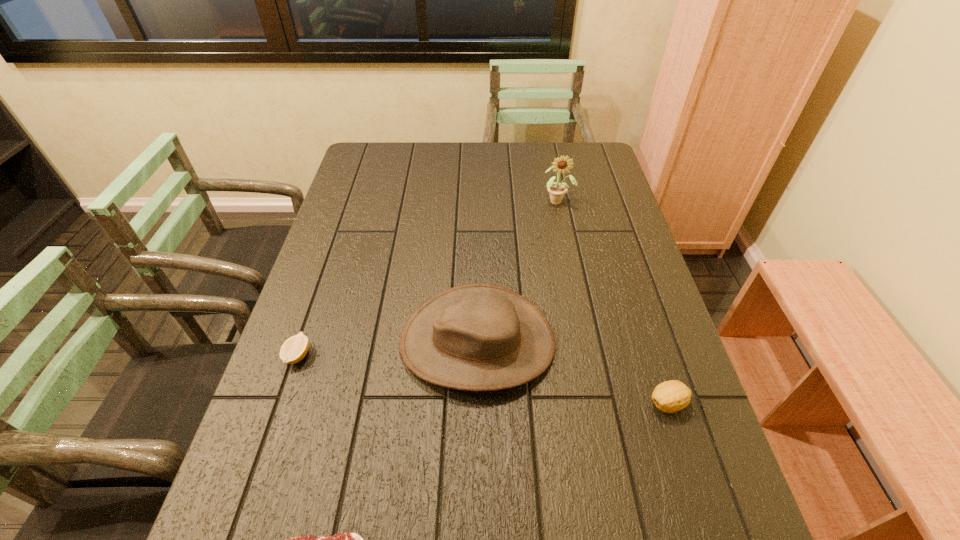
This screenshot has height=540, width=960. I want to click on vacant area between the farthest object and the fourth tallest object, so click(x=428, y=278).

This screenshot has width=960, height=540. In order to click on free space that is in between the taller lemon and the farthest object in this screenshot , I will do `click(612, 302)`.

I want to click on unoccupied position between the sunflower and the shorter lemon, so pyautogui.click(x=428, y=278).

The height and width of the screenshot is (540, 960). Identify the location of vacant space in between the sunflower and the cowboy hat. [517, 271].

Identify the location of free space between the second object from right to left and the cowboy hat. Image resolution: width=960 pixels, height=540 pixels. (517, 271).

At what (x,y) coordinates should I click in order to perform the action: click on free point between the fourth shortest object and the second shortest object. Please return your answer as a coordinate pair (x, y). Image resolution: width=960 pixels, height=540 pixels. Looking at the image, I should click on (x=388, y=348).

Locate an element on the screen. This screenshot has height=540, width=960. free space that is in between the cowboy hat and the farthest object is located at coordinates (517, 271).

Where is `object that is the third closest one to the fourth object from left to right`? object that is the third closest one to the fourth object from left to right is located at coordinates (294, 349).

Select which object appears as the third closest to the third tallest object. Please provide its 2D coordinates. Your answer should be formatted as a tuple, i.e. [(x, y)], where the tuple contains the x and y coordinates of a point satisfying the conditions above.

[(557, 190)]

Locate an element on the screen. vacant space that satisfies the following two spatial constraints: 1. on the back side of the left lemon; 2. on the left side of the cowboy hat is located at coordinates (302, 342).